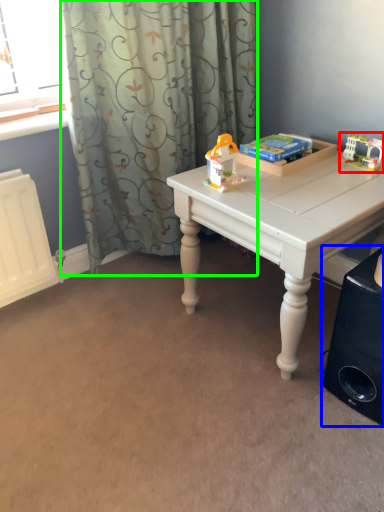
Question: Based on their relative distances, which object is nearer to toy (highlighted by a red box)? Choose from speaker (highlighted by a blue box) and curtain (highlighted by a green box).

Choices:
 (A) speaker
 (B) curtain

Answer: (A)